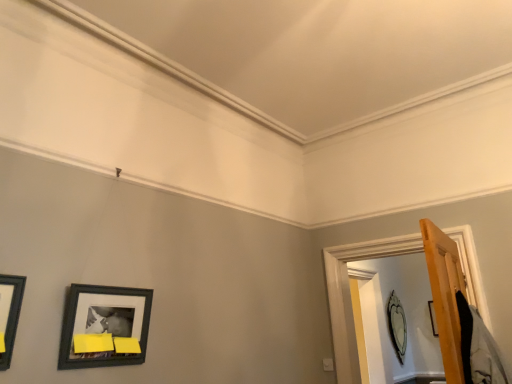
Question: Is wooden door frame at right thinner than matte black picture frame at upper right, which is counted as the 1th picture frame, starting from the bottom?

Choices:
 (A) no
 (B) yes

Answer: (A)

Question: Does wooden door frame at right have a smaller size compared to matte black picture frame at upper right, which is the second picture frame in front-to-back order?

Choices:
 (A) yes
 (B) no

Answer: (B)

Question: From the image's perspective, is wooden door frame at right on top of matte black picture frame at upper right, the second picture frame positioned from the top?

Choices:
 (A) yes
 (B) no

Answer: (A)

Question: From a real-world perspective, is wooden door frame at right on top of matte black picture frame at upper right, which is counted as the 1th picture frame, starting from the bottom?

Choices:
 (A) no
 (B) yes

Answer: (B)

Question: Is wooden door frame at right placed right next to matte black picture frame at upper right, which is the second picture frame in front-to-back order?

Choices:
 (A) no
 (B) yes

Answer: (A)

Question: Considering the relative sizes of wooden door frame at right and matte black picture frame at upper right, the second picture frame positioned from the top, in the image provided, is wooden door frame at right bigger than matte black picture frame at upper right, the second picture frame positioned from the top,?

Choices:
 (A) no
 (B) yes

Answer: (B)

Question: Does matte black picture frame at lower left, which is the 1th picture frame from front to back, have a larger size compared to wooden door frame at right?

Choices:
 (A) yes
 (B) no

Answer: (B)

Question: From a real-world perspective, is matte black picture frame at lower left, which is the 1th picture frame from front to back, on top of wooden door frame at right?

Choices:
 (A) no
 (B) yes

Answer: (A)

Question: Could you tell me if matte black picture frame at lower left, placed as the 2th picture frame when sorted from back to front, is facing wooden door frame at right?

Choices:
 (A) no
 (B) yes

Answer: (A)

Question: Is matte black picture frame at lower left, which is the 1th picture frame from front to back, turned away from wooden door frame at right?

Choices:
 (A) no
 (B) yes

Answer: (A)

Question: Is matte black picture frame at lower left, which is the 2th picture frame in bottom-to-top order, at the right side of wooden door frame at right?

Choices:
 (A) yes
 (B) no

Answer: (B)

Question: Is the position of matte black picture frame at lower left, which is the 2th picture frame in bottom-to-top order, more distant than that of wooden door frame at right?

Choices:
 (A) no
 (B) yes

Answer: (A)

Question: Is matte black picture frame at upper right, positioned as the 1th picture frame in back-to-front order, to the left of wooden door frame at right from the viewer's perspective?

Choices:
 (A) no
 (B) yes

Answer: (A)